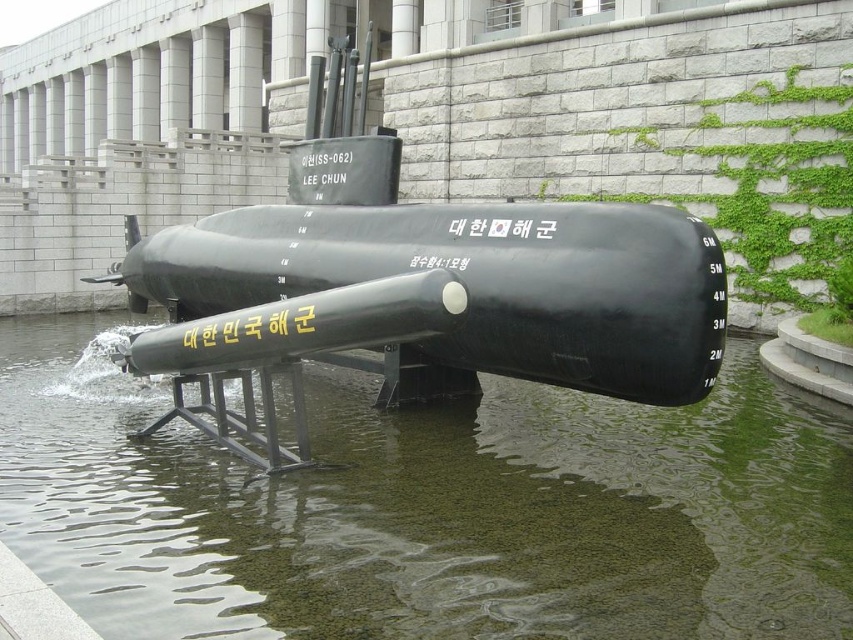
Question: Among these points, which one is farthest from the camera?

Choices:
 (A) (753, 424)
 (B) (321, 209)

Answer: (B)

Question: Can you confirm if transparent water at center is smaller than black matte submarine at center?

Choices:
 (A) yes
 (B) no

Answer: (A)

Question: Considering the relative positions of transparent water at center and black matte submarine at center in the image provided, where is transparent water at center located with respect to black matte submarine at center?

Choices:
 (A) left
 (B) right

Answer: (A)

Question: Can you confirm if transparent water at center is positioned above black matte submarine at center?

Choices:
 (A) yes
 (B) no

Answer: (B)